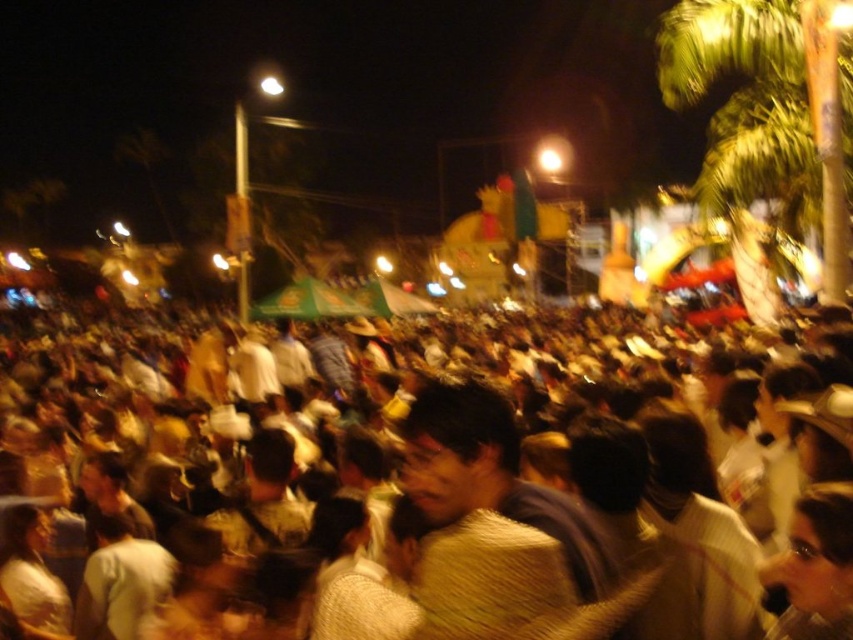
You are standing at the origin point in the image. Which direction should you move to reach the brown textured crowd at center?

The brown textured crowd at center is located at point 0.667 on the x axis and 0.134 on the y axis. Since you are at the origin, you should move right and slightly down to reach them.